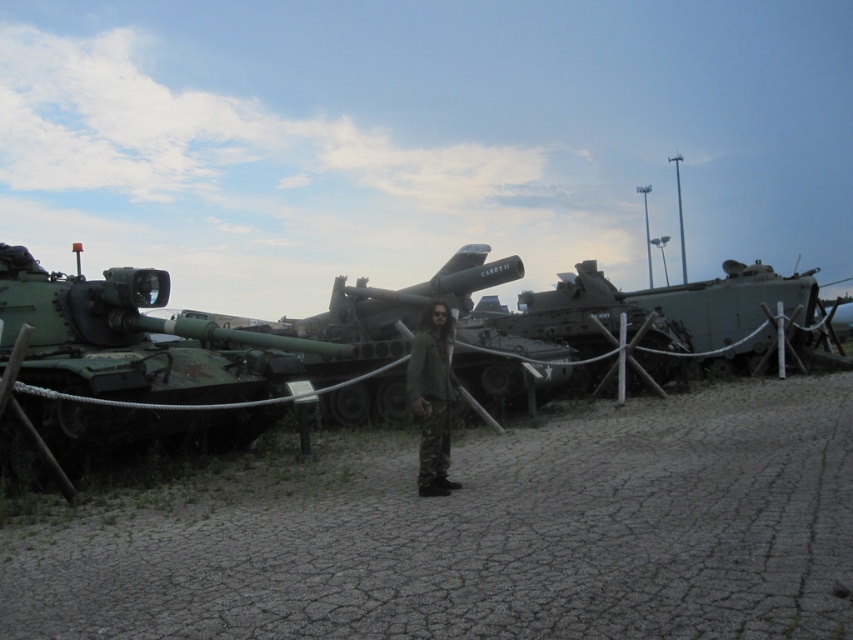
Question: Is green matte tank at left thinner than green camouflage pants at center?

Choices:
 (A) no
 (B) yes

Answer: (A)

Question: Can you confirm if green camouflage tank at center is wider than green matte tank at center?

Choices:
 (A) yes
 (B) no

Answer: (B)

Question: Estimate the real-world distances between objects in this image. Which object is closer to the green camouflage pants at center?

Choices:
 (A) dirt field at center
 (B) green matte tank at center
 (C) green matte tank at left
 (D) green camouflage tank at center

Answer: (A)

Question: Which object appears farthest from the camera in this image?

Choices:
 (A) green matte tank at center
 (B) green camouflage pants at center

Answer: (A)

Question: Based on their relative distances, which object is nearer to the green camouflage pants at center?

Choices:
 (A) green matte tank at left
 (B) green matte tank at center

Answer: (A)

Question: Does dirt field at center have a smaller size compared to green matte tank at left?

Choices:
 (A) yes
 (B) no

Answer: (B)